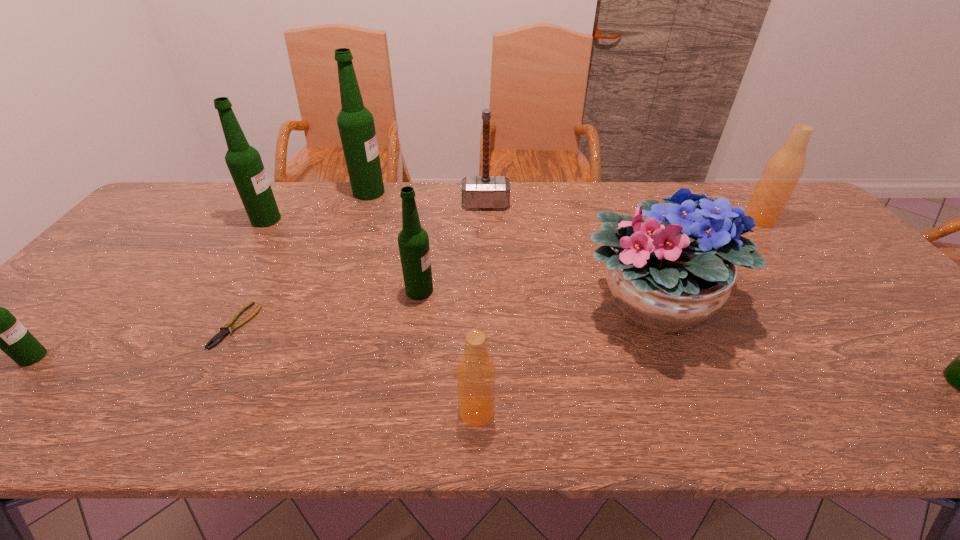
The height and width of the screenshot is (540, 960). Find the location of `vacant space located 0.220m on the left of the second beer bottle from right to left`. vacant space located 0.220m on the left of the second beer bottle from right to left is located at coordinates (674, 220).

Where is `vacant space situated 0.370m on the label of the fifth object from left to right`? This screenshot has width=960, height=540. vacant space situated 0.370m on the label of the fifth object from left to right is located at coordinates (576, 291).

What are the coordinates of `vacant space situated on the back of the bouquet` in the screenshot? It's located at (624, 238).

This screenshot has width=960, height=540. Identify the location of vacant space located on the label of the second nearest green beer bottle. (112, 357).

The image size is (960, 540). What are the coordinates of `free location located 0.300m on the right of the left tan beer bottle` in the screenshot? It's located at (644, 411).

This screenshot has height=540, width=960. I want to click on free space located on the back of the shortest object, so click(287, 233).

At what (x,y) coordinates should I click in order to perform the action: click on hammer that is at the far edge. Please return your answer as a coordinate pair (x, y). Looking at the image, I should click on (485, 191).

The image size is (960, 540). I want to click on object positioned at the near edge, so click(x=475, y=371).

Identify the location of object present at the left edge. The width and height of the screenshot is (960, 540). (0, 329).

Where is `object that is positioned at the right edge`? The image size is (960, 540). object that is positioned at the right edge is located at coordinates (785, 167).